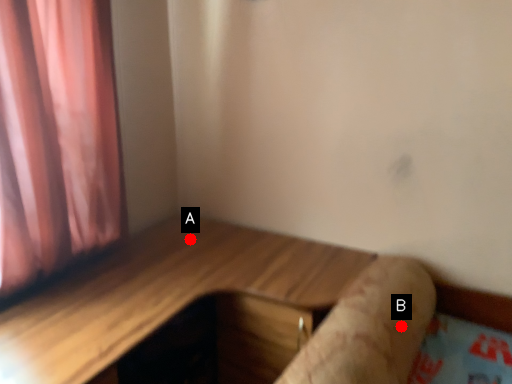
Question: Two points are circled on the image, labeled by A and B beside each circle. Among these points, which one is nearest to the camera?

Choices:
 (A) A is closer
 (B) B is closer

Answer: (B)